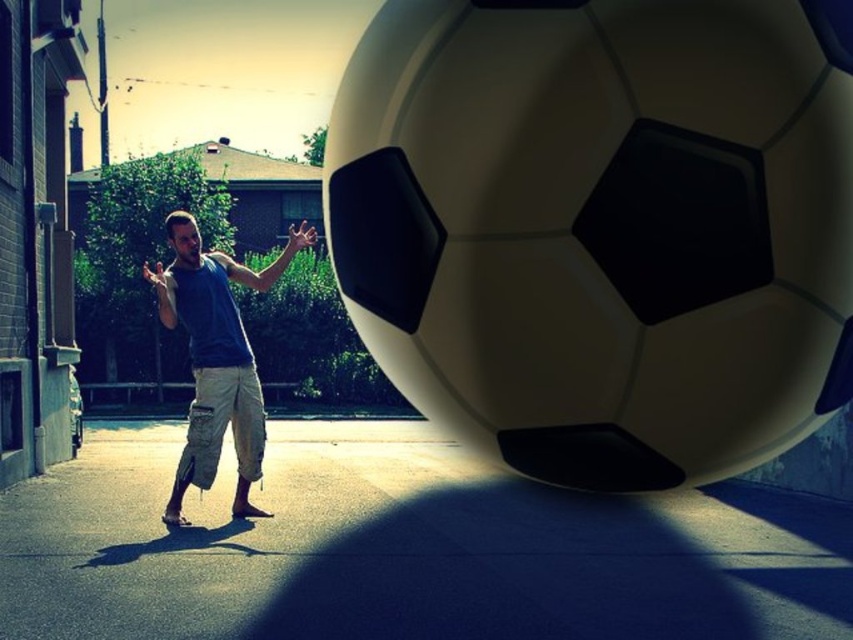
You are a drone operator trying to land a small drone on the smooth concrete pavement at lower center. According to the image, where exactly should you direct the drone to land?

The smooth concrete pavement at lower center is located at point (x=404, y=548), so you should direct the drone to land there.

You are a photographer trying to capture the soccer ball and the person in the scene. Since you want to focus on the person, where should you position the blue cotton tank top at center relative to the smooth concrete pavement at lower center in your photo?

The smooth concrete pavement at lower center is to the right of the blue cotton tank top at center, so to focus on the person, position the blue cotton tank top at center to the left of the smooth concrete pavement at lower center in your photo.

Based on the photo, you are a photographer trying to capture the soccer ball in the scene. Since the smooth concrete pavement at lower center and the blue cotton tank top at center are both in the frame, which object is nearer to you as you take the photo?

The smooth concrete pavement at lower center is closer to the viewer than the blue cotton tank top at center, so it is nearer to you when taking the photo.